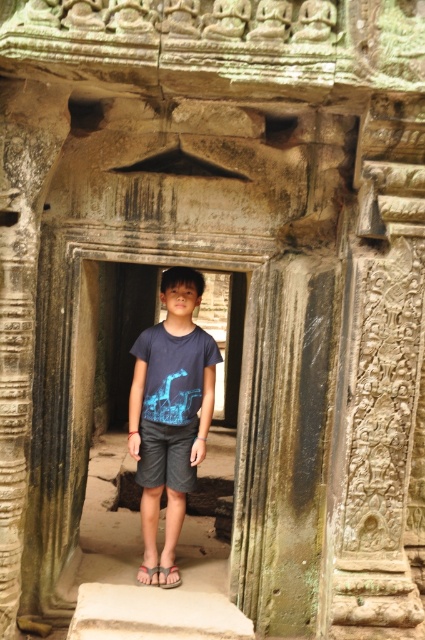
Can you confirm if dark gray cotton shorts at center is taller than gray fabric sandal at center?

Indeed, dark gray cotton shorts at center has a greater height compared to gray fabric sandal at center.

What do you see at coordinates (167, 456) in the screenshot? The image size is (425, 640). I see `dark gray cotton shorts at center` at bounding box center [167, 456].

At what (x,y) coordinates should I click in order to perform the action: click on dark gray cotton shorts at center. Please return your answer as a coordinate pair (x, y). Looking at the image, I should click on (167, 456).

Consider the image. Does smooth stone doorway at center have a lesser width compared to dark gray cotton shorts at center?

Incorrect, smooth stone doorway at center's width is not less than dark gray cotton shorts at center's.

Measure the distance between smooth stone doorway at center and camera.

A distance of 4.27 meters exists between smooth stone doorway at center and camera.

What are the coordinates of `smooth stone doorway at center` in the screenshot? It's located at (156, 524).

Who is positioned more to the left, matte blue t-shirt at center or gray fabric sandal at center?

From the viewer's perspective, gray fabric sandal at center appears more on the left side.

Find the location of `matte blue t-shirt at center`. matte blue t-shirt at center is located at coordinates (170, 408).

Is point (186, 273) closer to camera compared to point (170, 570)?

Yes.

Locate an element on the screen. matte blue t-shirt at center is located at coordinates (170, 408).